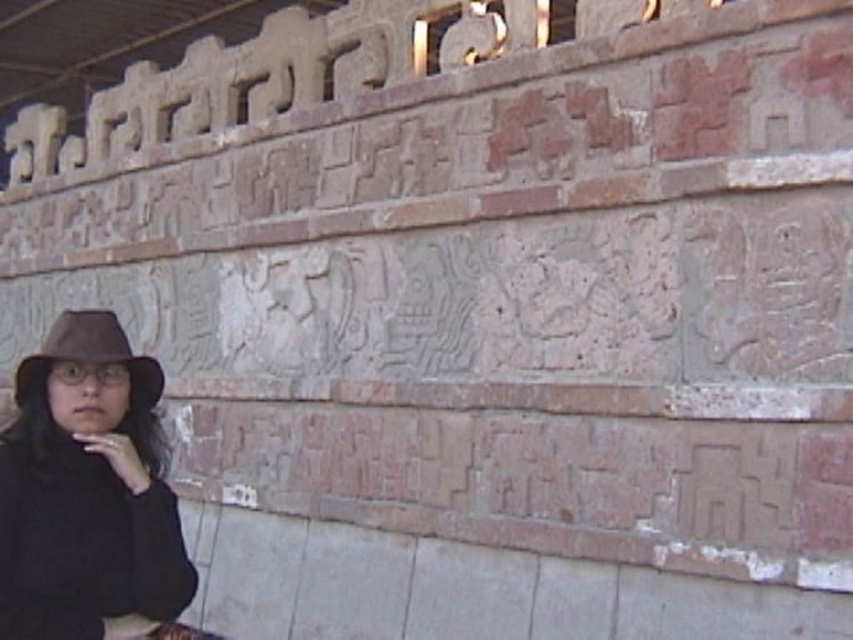
Can you confirm if brown felt hat at left is wider than white matte cigarette at lower left?

Yes.

Is point (45, 365) closer to camera compared to point (84, 440)?

No.

At what (x,y) coordinates should I click in order to perform the action: click on brown felt hat at left. Please return your answer as a coordinate pair (x, y). The height and width of the screenshot is (640, 853). Looking at the image, I should click on (90, 355).

Which is behind, point (129, 468) or point (111, 442)?

The point (129, 468) is more distant.

Measure the distance between point (152, 500) and camera.

They are 10.22 feet apart.

The height and width of the screenshot is (640, 853). What are the coordinates of `matte brown hat at left` in the screenshot? It's located at 86,490.

Between matte brown hat at left and brown felt hat at left, which one has less height?

With less height is brown felt hat at left.

Can you confirm if matte brown hat at left is positioned to the left of brown felt hat at left?

Yes, matte brown hat at left is to the left of brown felt hat at left.

At what (x,y) coordinates should I click in order to perform the action: click on matte brown hat at left. Please return your answer as a coordinate pair (x, y). Looking at the image, I should click on (86, 490).